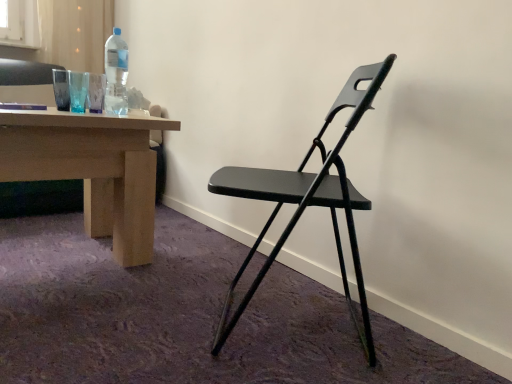
Where is `transparent plastic bottle at upper left`? The height and width of the screenshot is (384, 512). transparent plastic bottle at upper left is located at coordinates (116, 74).

Describe the element at coordinates (116, 74) in the screenshot. I see `transparent plastic bottle at upper left` at that location.

The width and height of the screenshot is (512, 384). What do you see at coordinates (307, 200) in the screenshot? I see `matte black folding chair at center` at bounding box center [307, 200].

At what (x,y) coordinates should I click in order to perform the action: click on matte black folding chair at center. Please return your answer as a coordinate pair (x, y). Looking at the image, I should click on (x=307, y=200).

The width and height of the screenshot is (512, 384). In order to click on transparent plastic bottle at upper left in this screenshot , I will do `click(116, 74)`.

Is transparent plastic bottle at upper left to the left of matte black folding chair at center from the viewer's perspective?

Indeed, transparent plastic bottle at upper left is positioned on the left side of matte black folding chair at center.

Is transparent plastic bottle at upper left further to camera compared to matte black folding chair at center?

That is True.

Is point (109, 99) positioned after point (342, 262)?

Yes, point (109, 99) is behind point (342, 262).

From the image's perspective, which object appears higher, transparent plastic bottle at upper left or matte black folding chair at center?

transparent plastic bottle at upper left.

From a real-world perspective, which object stands above the other?

transparent plastic bottle at upper left is physically above.

Is transparent plastic bottle at upper left wider or thinner than matte black folding chair at center?

Considering their sizes, transparent plastic bottle at upper left looks slimmer than matte black folding chair at center.

Can you confirm if transparent plastic bottle at upper left is taller than matte black folding chair at center?

Incorrect, the height of transparent plastic bottle at upper left is not larger of that of matte black folding chair at center.

Can you confirm if transparent plastic bottle at upper left is smaller than matte black folding chair at center?

Yes.

Is transparent plastic bottle at upper left not within matte black folding chair at center?

Yes, transparent plastic bottle at upper left is located beyond the bounds of matte black folding chair at center.

Is transparent plastic bottle at upper left not close to matte black folding chair at center?

They are positioned close to each other.

Is transparent plastic bottle at upper left facing away from matte black folding chair at center?

No, transparent plastic bottle at upper left is not facing the opposite direction of matte black folding chair at center.

How many degrees apart are the facing directions of transparent plastic bottle at upper left and matte black folding chair at center?

127 degrees separate the facing orientations of transparent plastic bottle at upper left and matte black folding chair at center.

The width and height of the screenshot is (512, 384). I want to click on bottle located behind the matte black folding chair at center, so click(x=116, y=74).

Can you confirm if matte black folding chair at center is positioned to the left of transparent plastic bottle at upper left?

Incorrect, matte black folding chair at center is not on the left side of transparent plastic bottle at upper left.

Does matte black folding chair at center come in front of transparent plastic bottle at upper left?

Yes, matte black folding chair at center is closer to the camera.

Which is farther, (343, 279) or (123, 89)?

The point (123, 89) is farther.

From the image's perspective, which one is positioned lower, matte black folding chair at center or transparent plastic bottle at upper left?

From the image's view, matte black folding chair at center is below.

From a real-world perspective, does matte black folding chair at center sit lower than transparent plastic bottle at upper left?

Indeed, from a real-world perspective, matte black folding chair at center is positioned beneath transparent plastic bottle at upper left.

Can you confirm if matte black folding chair at center is wider than transparent plastic bottle at upper left?

Indeed, matte black folding chair at center has a greater width compared to transparent plastic bottle at upper left.

From their relative heights in the image, would you say matte black folding chair at center is taller or shorter than transparent plastic bottle at upper left?

Clearly, matte black folding chair at center is taller compared to transparent plastic bottle at upper left.

Does matte black folding chair at center have a larger size compared to transparent plastic bottle at upper left?

Correct, matte black folding chair at center is larger in size than transparent plastic bottle at upper left.

Is matte black folding chair at center inside or outside of transparent plastic bottle at upper left?

matte black folding chair at center exists outside the volume of transparent plastic bottle at upper left.

Are matte black folding chair at center and transparent plastic bottle at upper left located far from each other?

No, matte black folding chair at center is not far away from transparent plastic bottle at upper left.

Is matte black folding chair at center oriented away from transparent plastic bottle at upper left?

No, matte black folding chair at center is not facing the opposite direction of transparent plastic bottle at upper left.

Can you tell me how much matte black folding chair at center and transparent plastic bottle at upper left differ in facing direction?

matte black folding chair at center and transparent plastic bottle at upper left are facing 127 degrees away from each other.

Identify the location of bottle on the left of the matte black folding chair at center. (116, 74).

The height and width of the screenshot is (384, 512). Find the location of `bottle that is above the matte black folding chair at center (from the image's perspective)`. bottle that is above the matte black folding chair at center (from the image's perspective) is located at coordinates (116, 74).

You are a GUI agent. You are given a task and a screenshot of the screen. Output one action in this format:
    pyautogui.click(x=<x>, y=<y>)
    Task: Click on the bottle behind the matte black folding chair at center
    
    Given the screenshot: What is the action you would take?
    pyautogui.click(x=116, y=74)